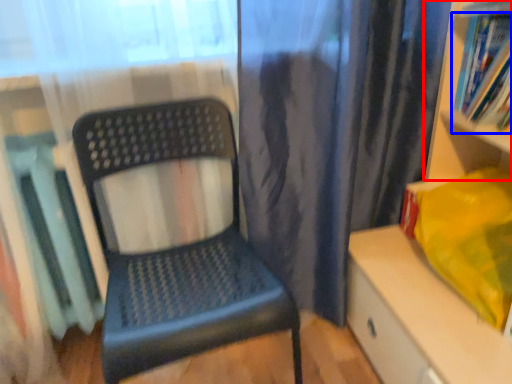
Question: Which object is further to the camera taking this photo, shelf (highlighted by a red box) or book (highlighted by a blue box)?

Choices:
 (A) shelf
 (B) book

Answer: (B)